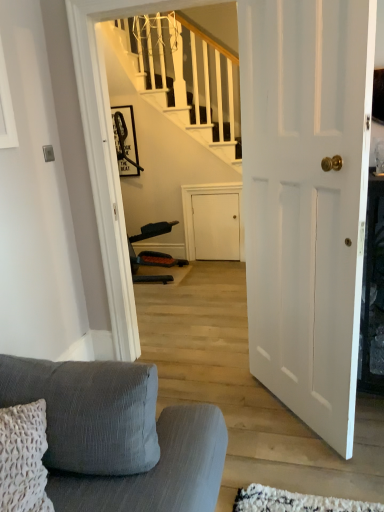
Identify the location of free space on the front side of white matte door at center. (297, 466).